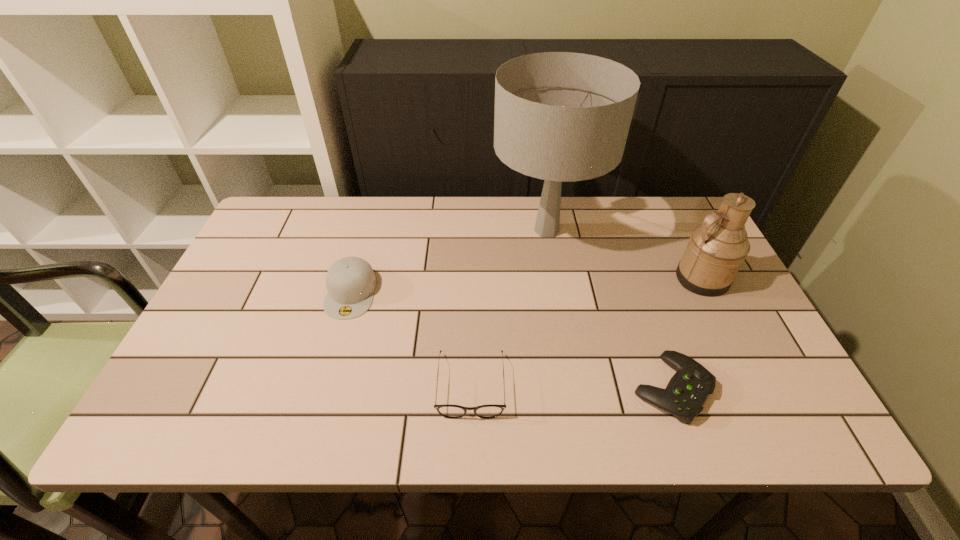
This screenshot has width=960, height=540. Identify the location of vacant space in between the leftmost object and the pitcher. (526, 286).

Locate an element on the screen. The height and width of the screenshot is (540, 960). free spot between the pitcher and the lampshade is located at coordinates (624, 254).

Locate an element on the screen. free space that is in between the tallest object and the cap is located at coordinates (448, 261).

You are a GUI agent. You are given a task and a screenshot of the screen. Output one action in this format:
    pyautogui.click(x=<x>, y=<y>)
    Task: Click on the object that stands as the closest to the rightmost object
    
    Given the screenshot: What is the action you would take?
    pyautogui.click(x=561, y=117)

Select which object appears as the closest to the lampshade. Please provide its 2D coordinates. Your answer should be formatted as a tuple, i.e. [(x, y)], where the tuple contains the x and y coordinates of a point satisfying the conditions above.

[(717, 248)]

You are a GUI agent. You are given a task and a screenshot of the screen. Output one action in this format:
    pyautogui.click(x=<x>, y=<y>)
    Task: Click on the free space that satisfies the following two spatial constraints: 1. on the front-facing side of the control; 2. on the left side of the third tallest object
    The height and width of the screenshot is (540, 960).
    Given the screenshot: What is the action you would take?
    pyautogui.click(x=324, y=388)

In order to click on vacant region that satisfies the following two spatial constraints: 1. on the front-facing side of the tallest object; 2. on the right side of the control in this screenshot , I will do `click(573, 388)`.

Locate an element on the screen. The image size is (960, 540). vacant space that satisfies the following two spatial constraints: 1. on the front-facing side of the tallest object; 2. through the lenses of the spectacles is located at coordinates (572, 386).

Where is `blank space that satisfies the following two spatial constraints: 1. on the front-facing side of the control; 2. on the right side of the tallest object`? The width and height of the screenshot is (960, 540). blank space that satisfies the following two spatial constraints: 1. on the front-facing side of the control; 2. on the right side of the tallest object is located at coordinates (573, 388).

What are the coordinates of `free location that satisfies the following two spatial constraints: 1. on the front-facing side of the tallest object; 2. on the front-facing side of the cap` in the screenshot? It's located at (557, 293).